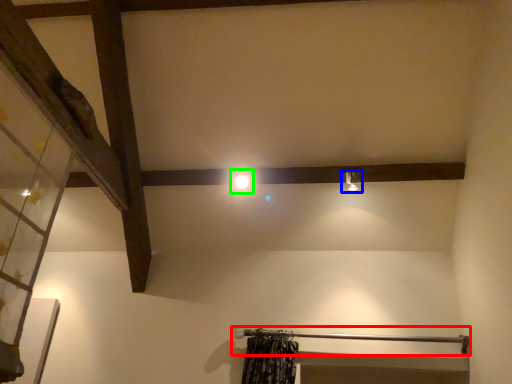
Question: Estimate the real-world distances between objects in this image. Which object is farther from beam (highlighted by a red box), light fixture (highlighted by a blue box) or light (highlighted by a green box)?

Choices:
 (A) light fixture
 (B) light

Answer: (B)